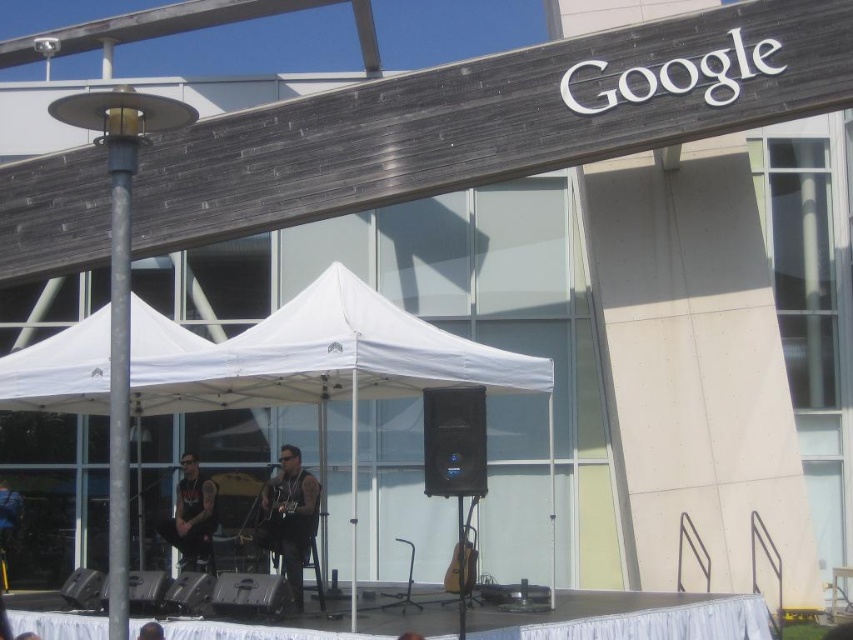
Question: Is white fabric tent at center below black leather vest at center?

Choices:
 (A) yes
 (B) no

Answer: (B)

Question: Which point is farther to the camera?

Choices:
 (A) (306, 547)
 (B) (209, 486)

Answer: (B)

Question: Among these objects, which one is nearest to the camera?

Choices:
 (A) black leather jacket at center
 (B) black leather vest at center
 (C) white fabric tent at center

Answer: (C)

Question: Can you confirm if white fabric tent at center is positioned above black leather jacket at center?

Choices:
 (A) no
 (B) yes

Answer: (B)

Question: Which object appears closest to the camera in this image?

Choices:
 (A) black leather vest at center
 (B) black leather jacket at center

Answer: (A)

Question: Is white fabric tent at center smaller than black leather vest at center?

Choices:
 (A) no
 (B) yes

Answer: (A)